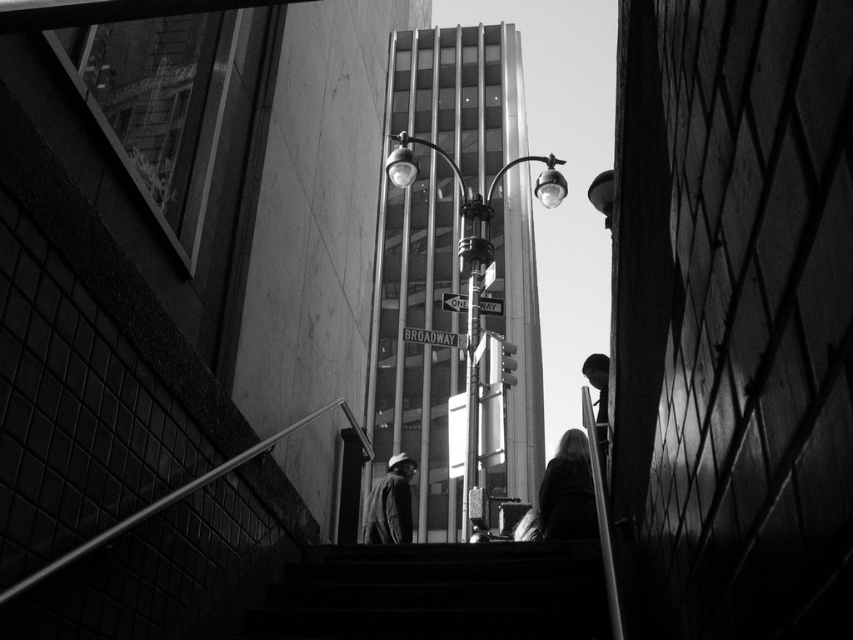
Between point (579, 464) and point (606, 368), which one is positioned in front?

Point (579, 464)

Can you confirm if silky black hair at lower right is wider than smooth black jacket at right?

No, silky black hair at lower right is not wider than smooth black jacket at right.

This screenshot has width=853, height=640. In order to click on silky black hair at lower right in this screenshot , I will do `click(567, 492)`.

Which is more to the right, smooth concrete stairs at center or matte gray jacket at center?

smooth concrete stairs at center

Which is more to the left, smooth concrete stairs at center or matte gray jacket at center?

Positioned to the left is matte gray jacket at center.

Which is behind, point (566, 572) or point (393, 515)?

The point (393, 515) is more distant.

Locate an element on the screen. smooth concrete stairs at center is located at coordinates (437, 593).

Is smooth concrete stairs at center further to camera compared to smooth black jacket at right?

Yes.

The image size is (853, 640). What are the coordinates of `smooth concrete stairs at center` in the screenshot? It's located at (437, 593).